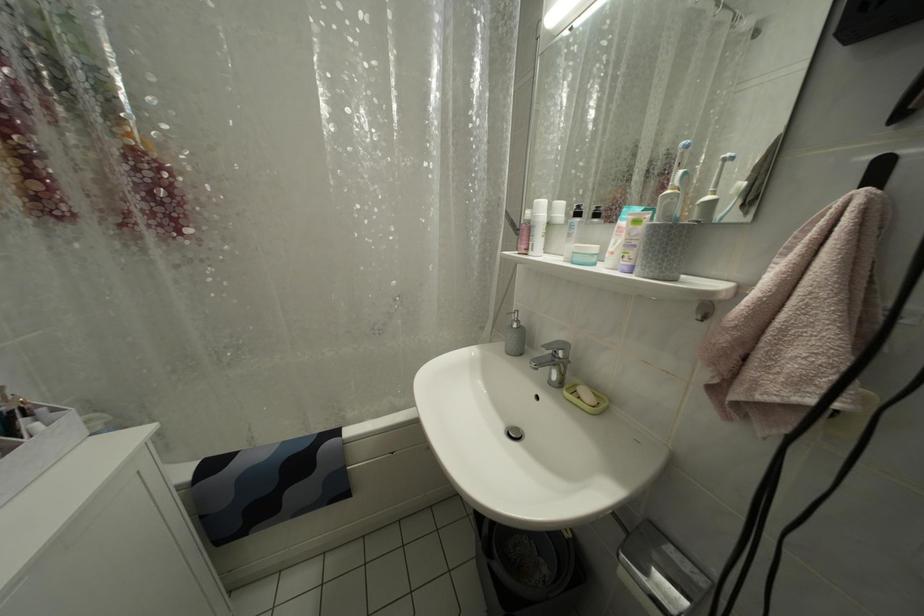
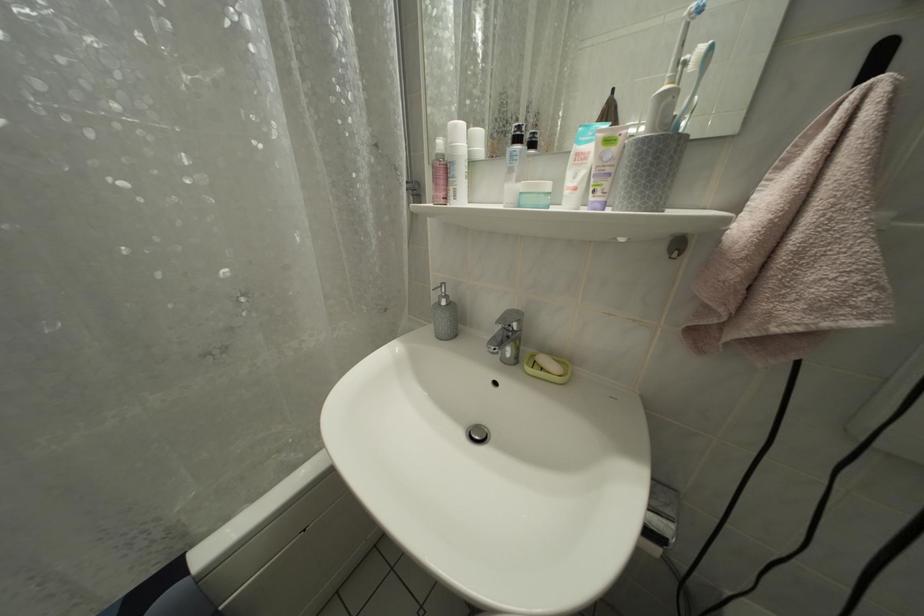
Question: What movement of the cameraman would produce the second image?

Choices:
 (A) Left
 (B) Right
 (C) Forward
 (D) Backward

Answer: (C)